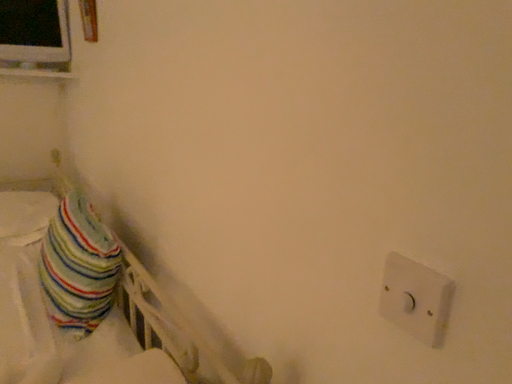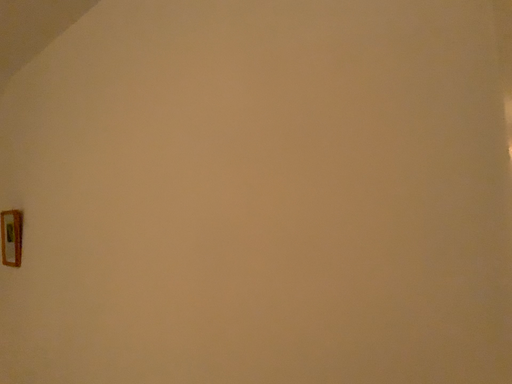
Question: Which way did the camera rotate in the video?

Choices:
 (A) rotated left
 (B) rotated right

Answer: (B)